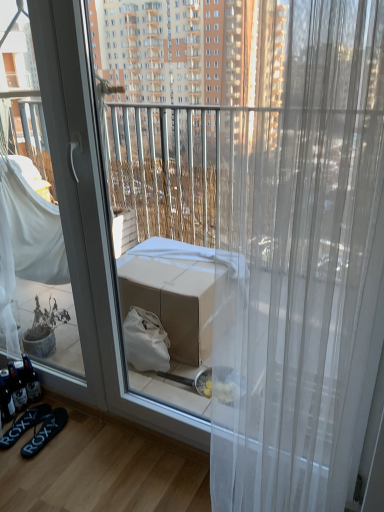
From the picture: Measure the distance between transparent sheer curtain at center and camera.

They are 23.11 inches apart.

What is the approximate width of black fabric flip-flops at lower left, the 2th footwear in the right-to-left sequence?

The width of black fabric flip-flops at lower left, the 2th footwear in the right-to-left sequence, is 11.16 inches.

Locate an element on the screen. black rubber flip-flops at lower left, which appears as the 2th footwear when viewed from the left is located at coordinates (45, 432).

Does black rubber flip-flops at lower left, which appears as the 2th footwear when viewed from the left, have a larger size compared to black fabric flip-flops at lower left, placed as the first footwear when sorted from left to right?

Indeed, black rubber flip-flops at lower left, which appears as the 2th footwear when viewed from the left, has a larger size compared to black fabric flip-flops at lower left, placed as the first footwear when sorted from left to right.

Considering the positions of point (56, 411) and point (27, 426), is point (56, 411) closer or farther from the camera than point (27, 426)?

Clearly, point (56, 411) is more distant from the camera than point (27, 426).

Can you confirm if black rubber flip-flops at lower left, which appears as the 2th footwear when viewed from the left, is thinner than black fabric flip-flops at lower left, placed as the first footwear when sorted from left to right?

Correct, the width of black rubber flip-flops at lower left, which appears as the 2th footwear when viewed from the left, is less than that of black fabric flip-flops at lower left, placed as the first footwear when sorted from left to right.

From the image's perspective, is black rubber flip-flops at lower left, the first footwear when ordered from right to left, under black fabric flip-flops at lower left, placed as the first footwear when sorted from left to right?

Yes, from the image's perspective, black rubber flip-flops at lower left, the first footwear when ordered from right to left, is beneath black fabric flip-flops at lower left, placed as the first footwear when sorted from left to right.

From a real-world perspective, who is located higher, black rubber flip-flops at lower left, the first footwear when ordered from right to left, or transparent sheer curtain at center?

transparent sheer curtain at center.

Is black rubber flip-flops at lower left, which appears as the 2th footwear when viewed from the left, closer to camera compared to transparent sheer curtain at center?

No, it is not.

From the picture: Does black rubber flip-flops at lower left, which appears as the 2th footwear when viewed from the left, have a greater width compared to transparent sheer curtain at center?

Indeed, black rubber flip-flops at lower left, which appears as the 2th footwear when viewed from the left, has a greater width compared to transparent sheer curtain at center.

Considering the relative positions of transparent sheer curtain at center and black rubber flip-flops at lower left, which appears as the 2th footwear when viewed from the left, in the image provided, is transparent sheer curtain at center to the left of black rubber flip-flops at lower left, which appears as the 2th footwear when viewed from the left, from the viewer's perspective?

No.

Looking at this image, is black rubber flip-flops at lower left, which appears as the 2th footwear when viewed from the left, a part of transparent sheer curtain at center?

No.

Find the location of `the 1st footwear behind the transparent sheer curtain at center, starting your count from the anchor`. the 1st footwear behind the transparent sheer curtain at center, starting your count from the anchor is located at coordinates (45, 432).

Based on the photo, does transparent sheer curtain at center have a larger size compared to black rubber flip-flops at lower left, which appears as the 2th footwear when viewed from the left?

Yes.

Who is taller, transparent sheer curtain at center or black fabric flip-flops at lower left, placed as the first footwear when sorted from left to right?

transparent sheer curtain at center is taller.

From a real-world perspective, is transparent sheer curtain at center over black fabric flip-flops at lower left, placed as the first footwear when sorted from left to right?

Yes, from a real-world perspective, transparent sheer curtain at center is above black fabric flip-flops at lower left, placed as the first footwear when sorted from left to right.

In terms of size, does transparent sheer curtain at center appear bigger or smaller than black fabric flip-flops at lower left, placed as the first footwear when sorted from left to right?

Clearly, transparent sheer curtain at center is larger in size than black fabric flip-flops at lower left, placed as the first footwear when sorted from left to right.

From the image's perspective, is black fabric flip-flops at lower left, placed as the first footwear when sorted from left to right, located beneath black rubber flip-flops at lower left, the first footwear when ordered from right to left?

Incorrect, from the image's perspective, black fabric flip-flops at lower left, placed as the first footwear when sorted from left to right, is higher than black rubber flip-flops at lower left, the first footwear when ordered from right to left.

From their relative heights in the image, would you say black fabric flip-flops at lower left, placed as the first footwear when sorted from left to right, is taller or shorter than black rubber flip-flops at lower left, the first footwear when ordered from right to left?

Considering their sizes, black fabric flip-flops at lower left, placed as the first footwear when sorted from left to right, has less height than black rubber flip-flops at lower left, the first footwear when ordered from right to left.

From the picture: Does black fabric flip-flops at lower left, placed as the first footwear when sorted from left to right, contain black rubber flip-flops at lower left, the first footwear when ordered from right to left?

No, black rubber flip-flops at lower left, the first footwear when ordered from right to left, is not a part of black fabric flip-flops at lower left, placed as the first footwear when sorted from left to right.

Is point (32, 417) more distant than point (46, 429)?

Yes.

Would you say black fabric flip-flops at lower left, placed as the first footwear when sorted from left to right, is inside or outside transparent sheer curtain at center?

black fabric flip-flops at lower left, placed as the first footwear when sorted from left to right, cannot be found inside transparent sheer curtain at center.

Is point (23, 425) positioned in front of point (272, 181)?

No, it is not.

Which of these two, black fabric flip-flops at lower left, the 2th footwear in the right-to-left sequence, or transparent sheer curtain at center, is wider?

With larger width is black fabric flip-flops at lower left, the 2th footwear in the right-to-left sequence.

Which of these two, black fabric flip-flops at lower left, the 2th footwear in the right-to-left sequence, or transparent sheer curtain at center, stands shorter?

With less height is black fabric flip-flops at lower left, the 2th footwear in the right-to-left sequence.

The height and width of the screenshot is (512, 384). I want to click on footwear that is on the left side of black rubber flip-flops at lower left, which appears as the 2th footwear when viewed from the left, so click(25, 424).

Identify the location of the 1st footwear behind the transparent sheer curtain at center, counting from the anchor's position. (45, 432).

Considering their positions, is transparent sheer curtain at center positioned closer to black rubber flip-flops at lower left, the first footwear when ordered from right to left, than black fabric flip-flops at lower left, the 2th footwear in the right-to-left sequence?

black fabric flip-flops at lower left, the 2th footwear in the right-to-left sequence.

Estimate the real-world distances between objects in this image. Which object is closer to transparent sheer curtain at center, black fabric flip-flops at lower left, the 2th footwear in the right-to-left sequence, or black rubber flip-flops at lower left, the first footwear when ordered from right to left?

black rubber flip-flops at lower left, the first footwear when ordered from right to left, is closer to transparent sheer curtain at center.

From the image, which object appears to be nearer to black fabric flip-flops at lower left, the 2th footwear in the right-to-left sequence, black rubber flip-flops at lower left, the first footwear when ordered from right to left, or transparent sheer curtain at center?

Among the two, black rubber flip-flops at lower left, the first footwear when ordered from right to left, is located nearer to black fabric flip-flops at lower left, the 2th footwear in the right-to-left sequence.

When comparing their distances from black fabric flip-flops at lower left, the 2th footwear in the right-to-left sequence, does transparent sheer curtain at center or black rubber flip-flops at lower left, the first footwear when ordered from right to left, seem closer?

black rubber flip-flops at lower left, the first footwear when ordered from right to left.

Looking at the image, which one is located further to black rubber flip-flops at lower left, the first footwear when ordered from right to left, black fabric flip-flops at lower left, placed as the first footwear when sorted from left to right, or transparent sheer curtain at center?

Based on the image, transparent sheer curtain at center appears to be further to black rubber flip-flops at lower left, the first footwear when ordered from right to left.

When comparing their distances from transparent sheer curtain at center, does black rubber flip-flops at lower left, which appears as the 2th footwear when viewed from the left, or black fabric flip-flops at lower left, the 2th footwear in the right-to-left sequence, seem further?

black fabric flip-flops at lower left, the 2th footwear in the right-to-left sequence, is positioned further to the anchor transparent sheer curtain at center.

Find the location of a particular element. footwear between transparent sheer curtain at center and black fabric flip-flops at lower left, the 2th footwear in the right-to-left sequence, along the z-axis is located at coordinates (45, 432).